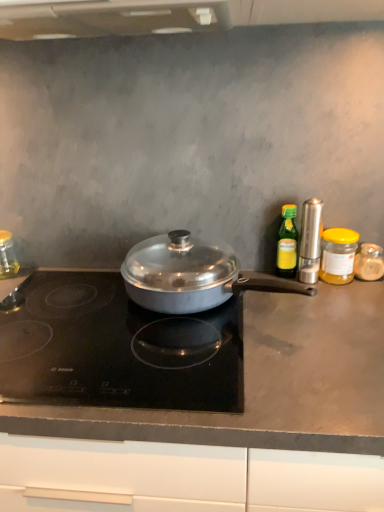
Question: Considering the relative sizes of yellow glass jar at right, arranged as the fifth kitchen appliance when viewed from the left, and satin silver pepper mill at right, acting as the third kitchen appliance starting from the right, in the image provided, is yellow glass jar at right, arranged as the fifth kitchen appliance when viewed from the left, wider than satin silver pepper mill at right, acting as the third kitchen appliance starting from the right,?

Choices:
 (A) no
 (B) yes

Answer: (B)

Question: Is yellow glass jar at right, arranged as the 2th kitchen appliance when viewed from the right, beside satin silver pepper mill at right, acting as the third kitchen appliance starting from the right?

Choices:
 (A) no
 (B) yes

Answer: (B)

Question: Does yellow glass jar at right, arranged as the fifth kitchen appliance when viewed from the left, have a larger size compared to satin silver pepper mill at right, acting as the third kitchen appliance starting from the right?

Choices:
 (A) yes
 (B) no

Answer: (A)

Question: From the image's perspective, does yellow glass jar at right, arranged as the fifth kitchen appliance when viewed from the left, appear higher than satin silver pepper mill at right, the 4th kitchen appliance positioned from the left?

Choices:
 (A) no
 (B) yes

Answer: (A)

Question: Does yellow glass jar at right, arranged as the 2th kitchen appliance when viewed from the right, appear on the right side of satin silver pepper mill at right, the 4th kitchen appliance positioned from the left?

Choices:
 (A) yes
 (B) no

Answer: (A)

Question: Considering the relative positions of green glass bottle at right, acting as the third kitchen appliance starting from the left, and yellow glass jar at right, arranged as the 2th kitchen appliance when viewed from the right, in the image provided, is green glass bottle at right, acting as the third kitchen appliance starting from the left, to the left or to the right of yellow glass jar at right, arranged as the 2th kitchen appliance when viewed from the right,?

Choices:
 (A) right
 (B) left

Answer: (B)

Question: In terms of width, does green glass bottle at right, acting as the third kitchen appliance starting from the left, look wider or thinner when compared to yellow glass jar at right, arranged as the 2th kitchen appliance when viewed from the right?

Choices:
 (A) wide
 (B) thin

Answer: (B)

Question: Is green glass bottle at right, acting as the third kitchen appliance starting from the left, situated inside yellow glass jar at right, arranged as the 2th kitchen appliance when viewed from the right, or outside?

Choices:
 (A) inside
 (B) outside

Answer: (B)

Question: Considering the positions of green glass bottle at right, which is the fourth kitchen appliance from right to left, and yellow glass jar at right, arranged as the fifth kitchen appliance when viewed from the left, in the image, is green glass bottle at right, which is the fourth kitchen appliance from right to left, bigger or smaller than yellow glass jar at right, arranged as the fifth kitchen appliance when viewed from the left,?

Choices:
 (A) big
 (B) small

Answer: (B)

Question: Is translucent glass jar at right, placed as the sixth kitchen appliance when sorted from left to right, bigger or smaller than satin silver pan at center, the 2th kitchen appliance from the left?

Choices:
 (A) big
 (B) small

Answer: (B)

Question: Would you say translucent glass jar at right, which is counted as the 1th kitchen appliance, starting from the right, is to the left or to the right of satin silver pan at center, the 2th kitchen appliance from the left, in the picture?

Choices:
 (A) left
 (B) right

Answer: (B)

Question: In the image, is translucent glass jar at right, which is counted as the 1th kitchen appliance, starting from the right, positioned in front of or behind satin silver pan at center, which ranks as the fifth kitchen appliance in right-to-left order?

Choices:
 (A) front
 (B) behind

Answer: (B)

Question: Which is correct: translucent glass jar at right, which is counted as the 1th kitchen appliance, starting from the right, is inside satin silver pan at center, the 2th kitchen appliance from the left, or outside of it?

Choices:
 (A) outside
 (B) inside

Answer: (A)

Question: From a real-world perspective, is black glass cooktop at center positioned above or below satin silver pepper mill at right, acting as the third kitchen appliance starting from the right?

Choices:
 (A) below
 (B) above

Answer: (A)

Question: Is black glass cooktop at center inside or outside of satin silver pepper mill at right, acting as the third kitchen appliance starting from the right?

Choices:
 (A) outside
 (B) inside

Answer: (A)